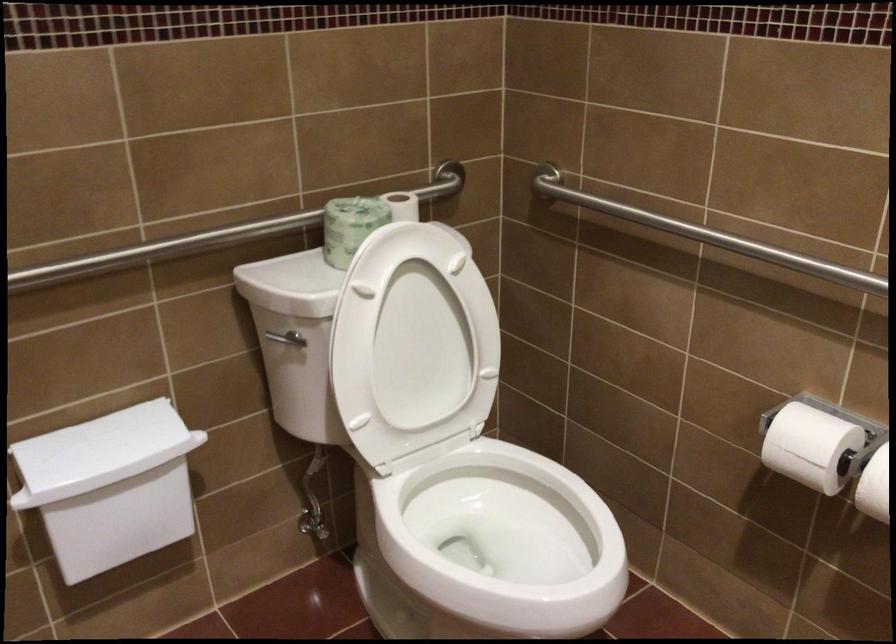
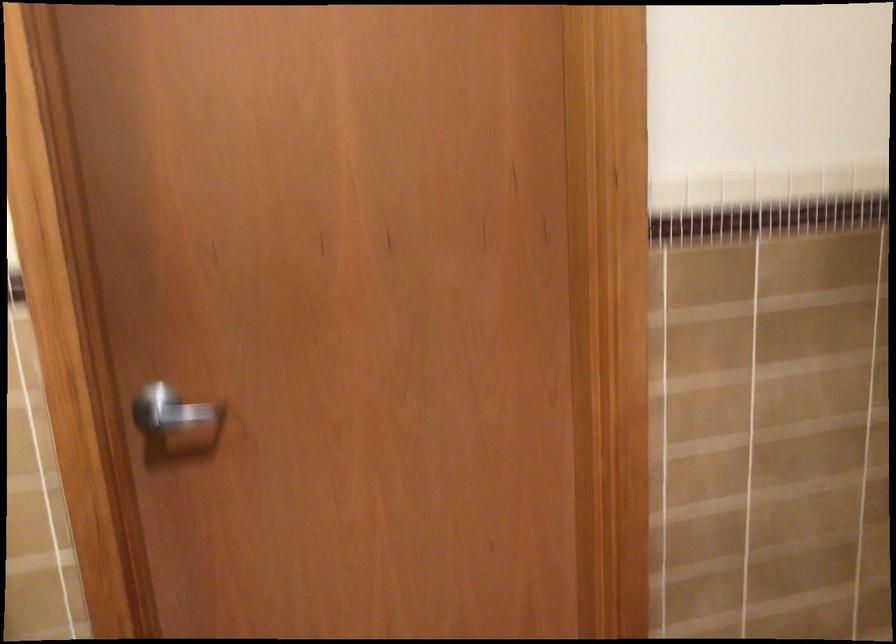
Based on the continuous images, in which direction is the camera rotating?

The camera's rotation is toward left-down.